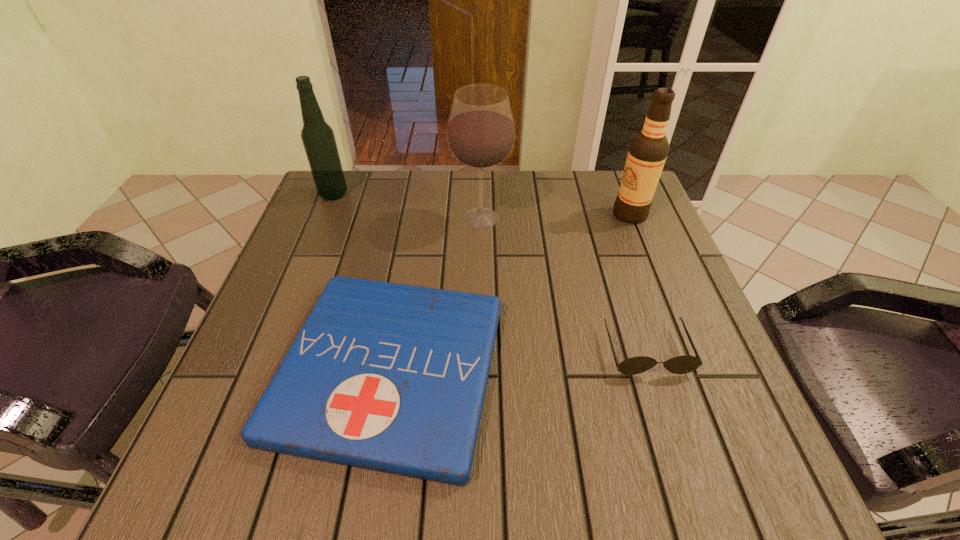
What are the coordinates of `vacant region located 0.080m on the front-facing side of the sunglasses` in the screenshot? It's located at (668, 418).

What are the coordinates of `vacant space located on the back of the first-aid kit` in the screenshot? It's located at (413, 236).

Identify the location of object that is at the near edge. The width and height of the screenshot is (960, 540). (389, 377).

The height and width of the screenshot is (540, 960). In order to click on alcohol located at the left edge in this screenshot , I will do `click(318, 138)`.

Locate an element on the screen. the first-aid kit that is at the left edge is located at coordinates (389, 377).

The width and height of the screenshot is (960, 540). Identify the location of alcohol at the right edge. (648, 150).

Find the location of `sunglasses situated at the right edge`. sunglasses situated at the right edge is located at coordinates (681, 364).

The image size is (960, 540). Find the location of `object that is at the far left corner`. object that is at the far left corner is located at coordinates pos(318,138).

This screenshot has height=540, width=960. What are the coordinates of `object that is at the near left corner` in the screenshot? It's located at (389, 377).

This screenshot has height=540, width=960. I want to click on object that is at the far right corner, so [648, 150].